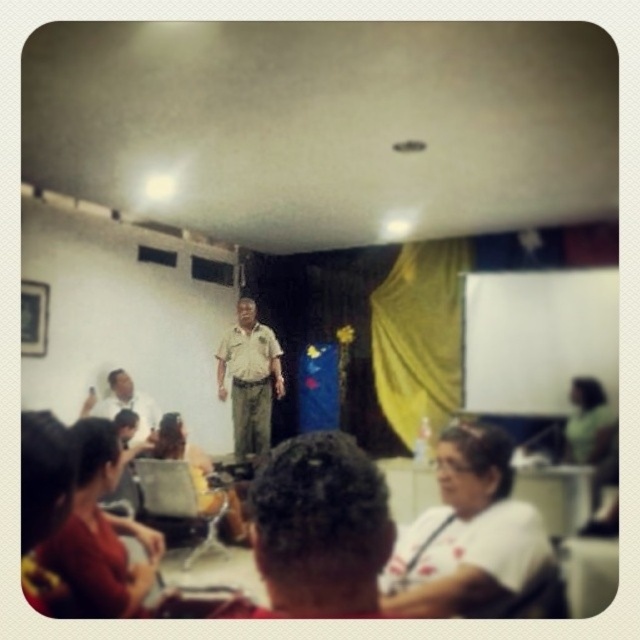
From the picture: You are a photographer trying to capture a candid shot of the white matte shirt at lower center and the matte khaki uniform at lower left without them noticing. Since you want to ensure both subjects are in focus, you need to know which one is closer to the camera. Can you determine which is closer based on their positions?

The white matte shirt at lower center is shorter than the matte khaki uniform at lower left, so the white matte shirt at lower center is closer to the camera.

You are organizing a small event and need to arrange seating based on the attendees. Looking at the image, which attendee should be seated closer to the front due to their clothing size? Please choose between the white matte shirt at lower center and the matte khaki uniform at lower left.

The white matte shirt at lower center occupies less space than the matte khaki uniform at lower left, so the attendee wearing the matte khaki uniform at lower left should be seated closer to the front to accommodate their larger size.